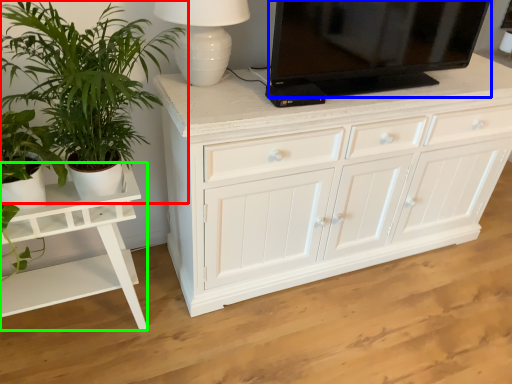
Question: Which is farther away from houseplant (highlighted by a red box)? television (highlighted by a blue box) or table (highlighted by a green box)?

Choices:
 (A) television
 (B) table

Answer: (A)